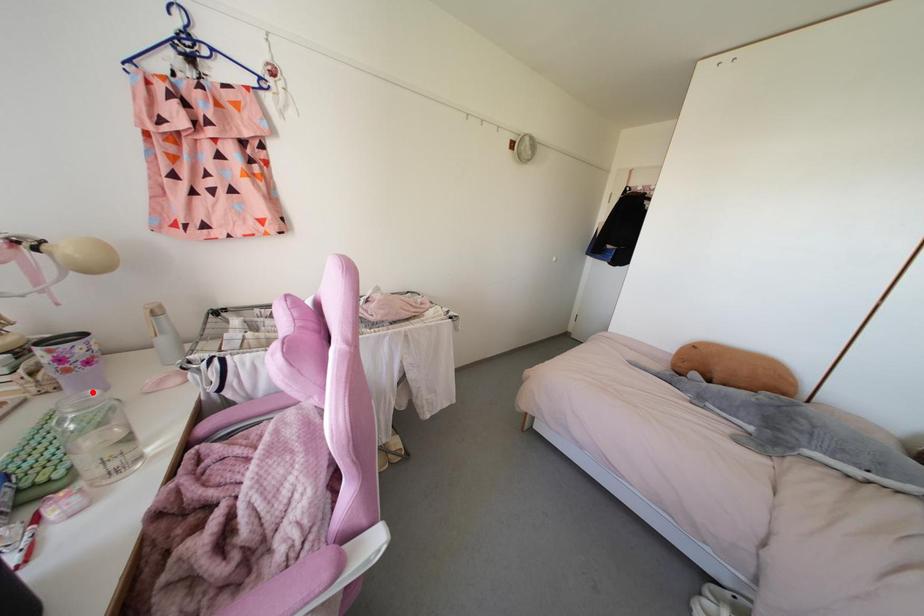
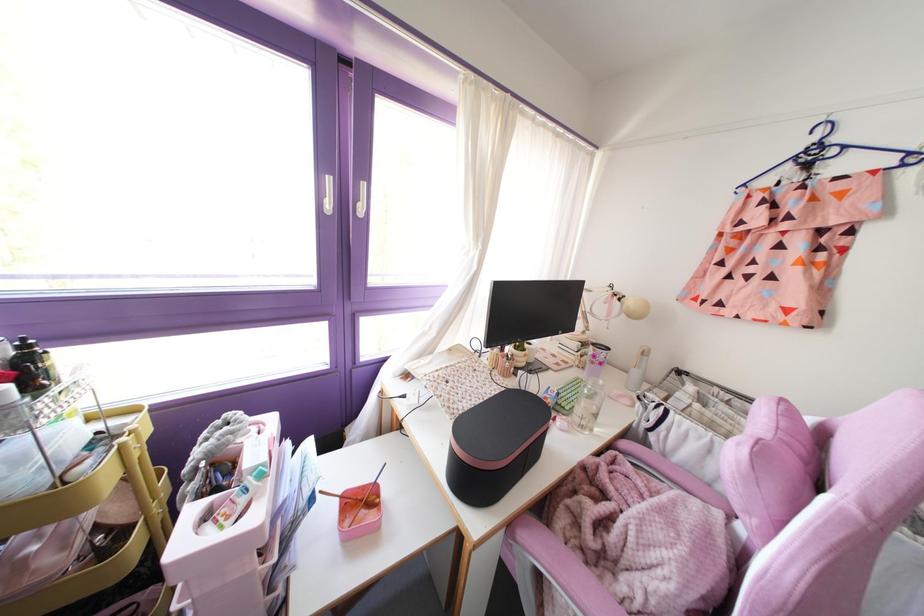
Find the pixel in the second image that matches the highlighted location in the first image.

(601, 382)